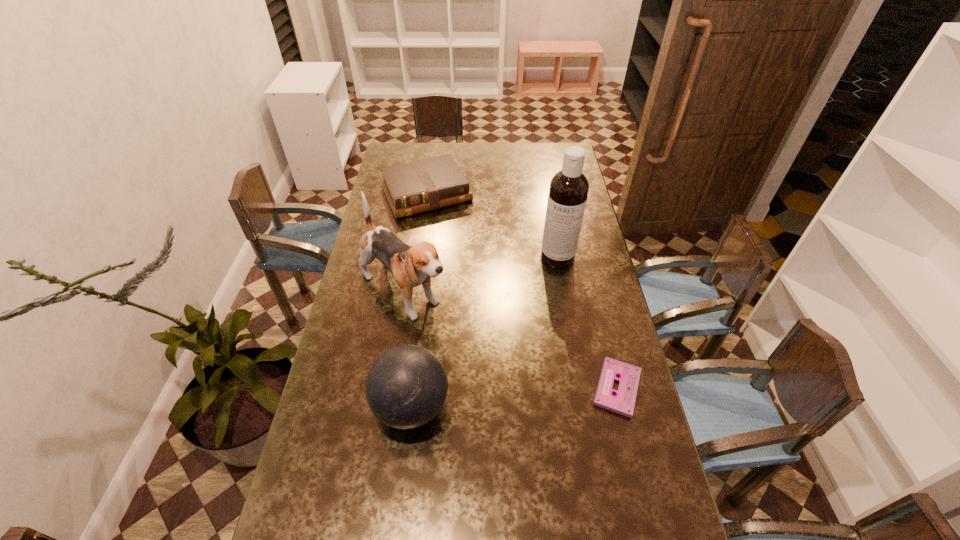
Where is `bowling ball`? bowling ball is located at coordinates (406, 387).

Where is `the shortest object`? This screenshot has width=960, height=540. the shortest object is located at coordinates (623, 402).

Image resolution: width=960 pixels, height=540 pixels. What are the coordinates of `puppy` in the screenshot? It's located at (410, 266).

At what (x,y) coordinates should I click in order to perform the action: click on dishwasher detergent. Please return your answer as a coordinate pair (x, y). Image resolution: width=960 pixels, height=540 pixels. Looking at the image, I should click on (568, 191).

This screenshot has width=960, height=540. Identify the location of Bible. (418, 186).

I want to click on the second shortest object, so click(x=418, y=186).

At what (x,y) coordinates should I click in order to perform the action: click on vacant position located on the grip area of the third shortest object. Please return your answer as a coordinate pair (x, y). The image size is (960, 540). Looking at the image, I should click on (331, 406).

The image size is (960, 540). I want to click on vacant area situated 0.280m on the front of the videotape, so click(x=652, y=530).

Find the location of a particular element. The image size is (960, 540). free spot located at the face of the fourth shortest object is located at coordinates (495, 372).

Locate an element on the screen. The image size is (960, 540). vacant region located 0.080m at the face of the fourth shortest object is located at coordinates (449, 333).